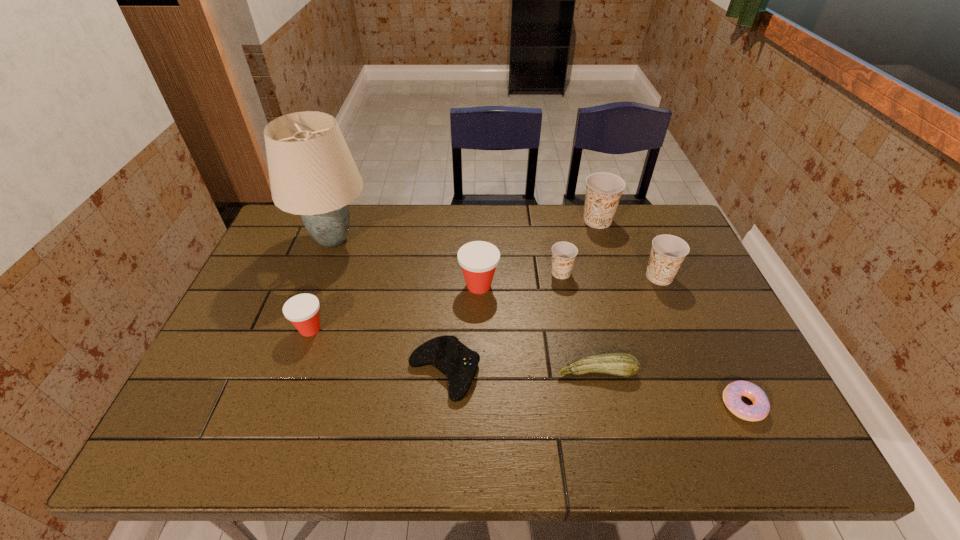
This screenshot has height=540, width=960. In order to click on white lampshade in this screenshot , I will do `click(312, 173)`.

This screenshot has height=540, width=960. Identify the location of the tallest object. (312, 173).

This screenshot has height=540, width=960. In order to click on the second orange Dixie cup from right to left in this screenshot , I will do `click(603, 190)`.

The width and height of the screenshot is (960, 540). What are the coordinates of `the biggest orange Dixie cup` in the screenshot? It's located at (603, 190).

Locate an element on the screen. This screenshot has height=540, width=960. the right red-orange Dixie cup is located at coordinates (478, 259).

Where is `the second Dixie cup from left to right`? Image resolution: width=960 pixels, height=540 pixels. the second Dixie cup from left to right is located at coordinates tap(478, 259).

This screenshot has height=540, width=960. Identify the location of the rightmost Dixie cup. (668, 251).

Image resolution: width=960 pixels, height=540 pixels. Identify the location of the rightmost orange Dixie cup. (668, 251).

The width and height of the screenshot is (960, 540). I want to click on the nearest Dixie cup, so click(302, 310).

Where is `the left red-orange Dixie cup`? The height and width of the screenshot is (540, 960). the left red-orange Dixie cup is located at coordinates (302, 310).